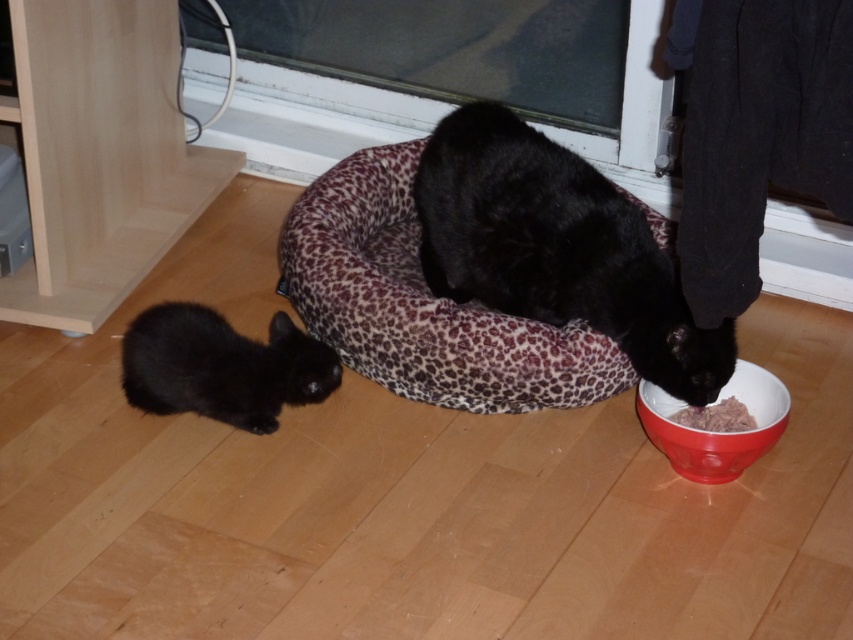
Who is positioned more to the left, black fur cat at center or red glossy bowl at lower right?

From the viewer's perspective, black fur cat at center appears more on the left side.

Who is higher up, black fur cat at center or red glossy bowl at lower right?

black fur cat at center is higher up.

Does point (515, 220) come behind point (747, 403)?

Yes.

The height and width of the screenshot is (640, 853). I want to click on black fur cat at center, so click(556, 248).

Can you confirm if black fur cat at lower left is positioned above red glossy bowl at lower right?

Correct, black fur cat at lower left is located above red glossy bowl at lower right.

Does point (198, 401) lie in front of point (682, 406)?

Yes, point (198, 401) is in front of point (682, 406).

Locate an element on the screen. The width and height of the screenshot is (853, 640). black fur cat at lower left is located at coordinates coord(222,365).

Which is behind, point (680, 397) or point (717, 422)?

The point (717, 422) is behind.

The image size is (853, 640). What do you see at coordinates (556, 248) in the screenshot?
I see `black fur cat at center` at bounding box center [556, 248].

Between point (485, 273) and point (698, 417), which one is positioned in front?

Point (698, 417) is in front.

Locate an element on the screen. black fur cat at center is located at coordinates (556, 248).